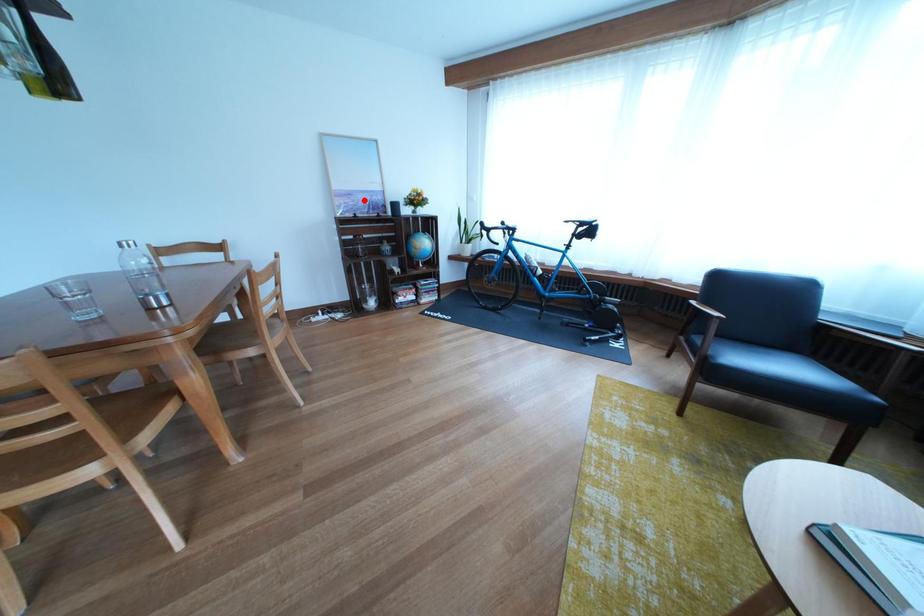
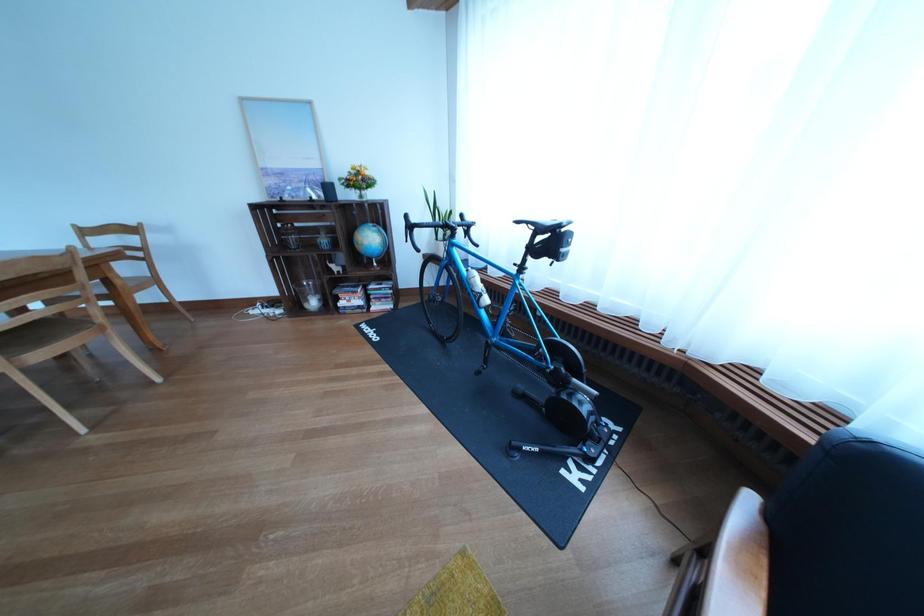
Where in the second image is the point corresponding to the highlighted location from the first image?

(294, 179)